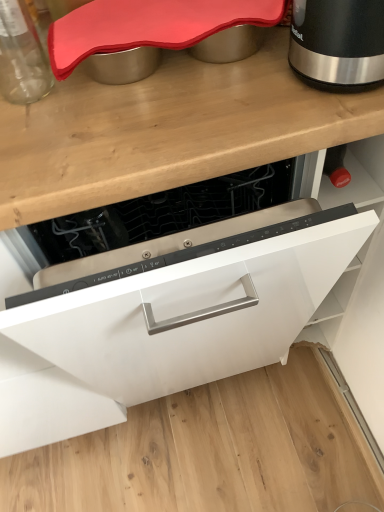
I want to click on free space to the left of black metallic kettle at upper right, so click(x=231, y=119).